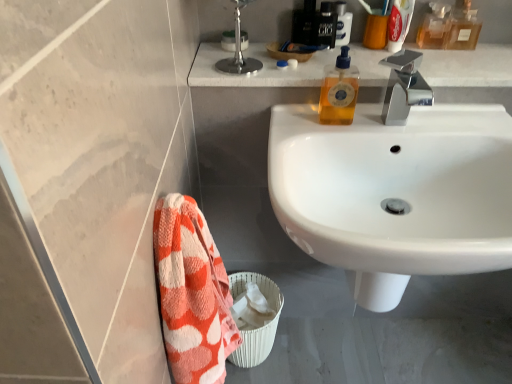
The width and height of the screenshot is (512, 384). I want to click on spots to the right of white woven basket at lower center, so click(x=309, y=347).